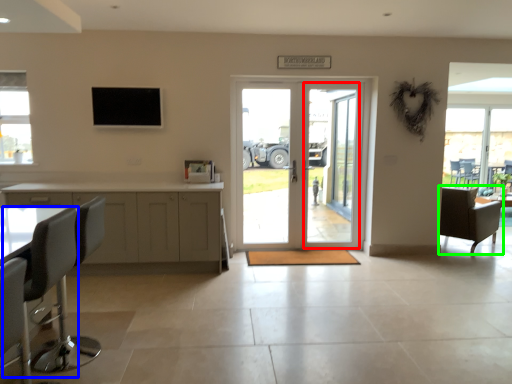
Question: Based on their relative distances, which object is nearer to screen door (highlighted by a red box)? Choose from swivel chair (highlighted by a blue box) and chair (highlighted by a green box).

Choices:
 (A) swivel chair
 (B) chair

Answer: (B)